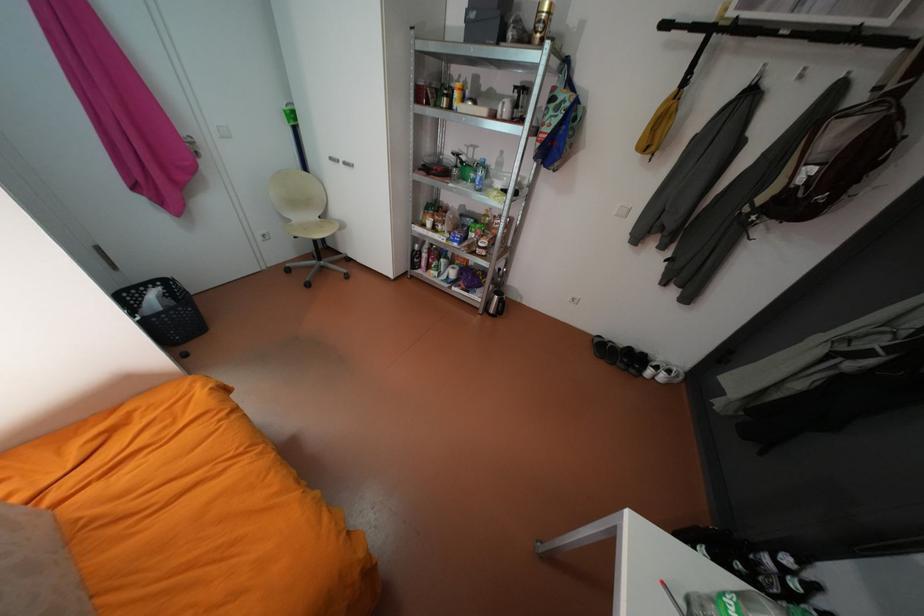
This screenshot has height=616, width=924. I want to click on green plastic bottle, so click(x=467, y=171).